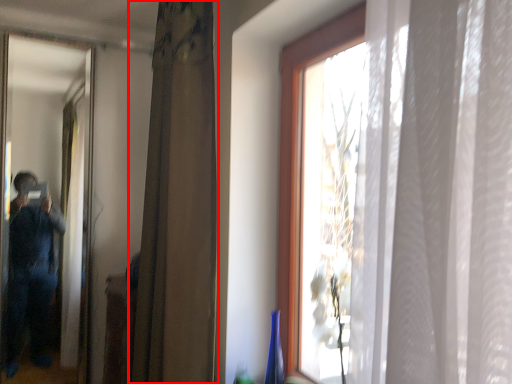
Question: Observing the image, what is the correct spatial positioning of curtain (annotated by the red box) in reference to mirror?

Choices:
 (A) right
 (B) left

Answer: (A)